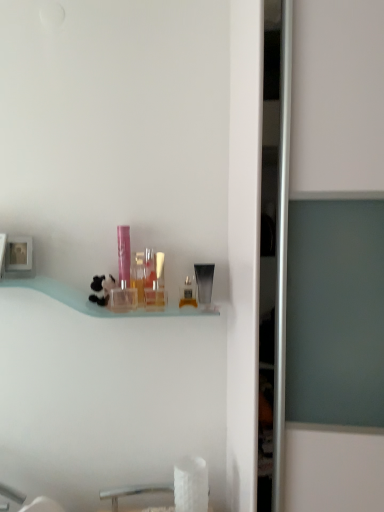
What do you see at coordinates (204, 282) in the screenshot? I see `clear plastic container at center, which ranks as the sixth toiletry in left-to-right order` at bounding box center [204, 282].

How much space does translucent plastic container at center, the 2th toiletry viewed from the left, occupy vertically?

translucent plastic container at center, the 2th toiletry viewed from the left, is 7.40 inches tall.

At what (x,y) coordinates should I click in order to perform the action: click on white ceramic sink at lower center. Please return your answer as a coordinate pair (x, y). Looking at the image, I should click on (174, 487).

Image resolution: width=384 pixels, height=512 pixels. Describe the element at coordinates (160, 279) in the screenshot. I see `translucent plastic perfume bottle at center, the 4th toiletry when ordered from left to right` at that location.

Identify the location of white matte toilet paper at lower center. (191, 485).

At what (x,y) coordinates should I click in order to perform the action: click on clear plastic bottle at center, the 5th toiletry in the left-to-right sequence. Please return your answer as a coordinate pair (x, y). Looking at the image, I should click on (188, 293).

From their relative heights in the image, would you say white matte toilet paper at lower center is taller or shorter than clear plastic container at center, placed as the 1th toiletry when sorted from right to left?

Clearly, white matte toilet paper at lower center is taller compared to clear plastic container at center, placed as the 1th toiletry when sorted from right to left.

Can you confirm if white matte toilet paper at lower center is bigger than clear plastic container at center, placed as the 1th toiletry when sorted from right to left?

Correct, white matte toilet paper at lower center is larger in size than clear plastic container at center, placed as the 1th toiletry when sorted from right to left.

Locate an element on the screen. The image size is (384, 512). toilet paper on the left of the clear plastic container at center, placed as the 1th toiletry when sorted from right to left is located at coordinates (191, 485).

Is point (200, 505) less distant than point (210, 285)?

Yes, point (200, 505) is closer to viewer.

Is translucent plastic container at center, the fifth toiletry in the right-to-left sequence, oriented towards white ceramic sink at lower center?

No, translucent plastic container at center, the fifth toiletry in the right-to-left sequence, is not turned towards white ceramic sink at lower center.

In terms of size, does translucent plastic container at center, the 2th toiletry viewed from the left, appear bigger or smaller than white ceramic sink at lower center?

In the image, translucent plastic container at center, the 2th toiletry viewed from the left, appears to be smaller than white ceramic sink at lower center.

Based on the photo, is translucent plastic container at center, the 2th toiletry viewed from the left, at the left side of white ceramic sink at lower center?

Yes.

Is translucent plastic container at center, the fifth toiletry in the right-to-left sequence, placed right next to white ceramic sink at lower center?

translucent plastic container at center, the fifth toiletry in the right-to-left sequence, is not next to white ceramic sink at lower center, and they're not touching.

Considering the relative sizes of white ceramic sink at lower center and clear plastic container at center, placed as the 4th toiletry when sorted from right to left, in the image provided, is white ceramic sink at lower center bigger than clear plastic container at center, placed as the 4th toiletry when sorted from right to left,?

Yes.

Based on the photo, considering the positions of objects white ceramic sink at lower center and clear plastic container at center, placed as the 4th toiletry when sorted from right to left, in the image provided, who is more to the left, white ceramic sink at lower center or clear plastic container at center, placed as the 4th toiletry when sorted from right to left,?

Positioned to the left is clear plastic container at center, placed as the 4th toiletry when sorted from right to left.

Could you tell me if white ceramic sink at lower center is turned towards clear plastic container at center, the 3th toiletry positioned from the left?

No.

From a real-world perspective, count 5th toiletrys upward from the white ceramic sink at lower center and point to it. Please provide its 2D coordinates.

[(150, 278)]

Are translucent plastic perfume bottle at center, the 4th toiletry when ordered from left to right, and white matte toilet paper at lower center located far from each other?

Actually, translucent plastic perfume bottle at center, the 4th toiletry when ordered from left to right, and white matte toilet paper at lower center are a little close together.

Is translucent plastic perfume bottle at center, positioned as the third toiletry in right-to-left order, outside of white matte toilet paper at lower center?

translucent plastic perfume bottle at center, positioned as the third toiletry in right-to-left order, is positioned outside white matte toilet paper at lower center.

What are the coordinates of `the 2nd toiletry counting from the left side of the white matte toilet paper at lower center` in the screenshot? It's located at (160, 279).

Which of these two, translucent plastic perfume bottle at center, the 4th toiletry when ordered from left to right, or white ceramic sink at lower center, is wider?

With larger width is translucent plastic perfume bottle at center, the 4th toiletry when ordered from left to right.

How far apart are translucent plastic perfume bottle at center, positioned as the third toiletry in right-to-left order, and white ceramic sink at lower center?

They are 22.97 inches apart.

Consider the image. Considering the relative positions of translucent plastic perfume bottle at center, positioned as the third toiletry in right-to-left order, and white ceramic sink at lower center in the image provided, is translucent plastic perfume bottle at center, positioned as the third toiletry in right-to-left order, to the left or to the right of white ceramic sink at lower center?

In the image, translucent plastic perfume bottle at center, positioned as the third toiletry in right-to-left order, appears on the right side of white ceramic sink at lower center.

Who is taller, clear plastic bottle at center, which is counted as the 2th toiletry, starting from the right, or clear plastic container at center, placed as the 1th toiletry when sorted from right to left?

Standing taller between the two is clear plastic container at center, placed as the 1th toiletry when sorted from right to left.

Considering the positions of objects clear plastic bottle at center, the 5th toiletry in the left-to-right sequence, and clear plastic container at center, which ranks as the sixth toiletry in left-to-right order, in the image provided, who is more to the right, clear plastic bottle at center, the 5th toiletry in the left-to-right sequence, or clear plastic container at center, which ranks as the sixth toiletry in left-to-right order,?

Positioned to the right is clear plastic container at center, which ranks as the sixth toiletry in left-to-right order.

Which object is further away from the camera taking this photo, clear plastic bottle at center, the 5th toiletry in the left-to-right sequence, or clear plastic container at center, which ranks as the sixth toiletry in left-to-right order?

Positioned behind is clear plastic container at center, which ranks as the sixth toiletry in left-to-right order.

Which is closer, (186, 277) or (197, 272)?

The point (186, 277) is more forward.

Which object is positioned more to the left, clear plastic container at center, which ranks as the sixth toiletry in left-to-right order, or translucent plastic container at center, the 2th toiletry viewed from the left?

translucent plastic container at center, the 2th toiletry viewed from the left.

Looking at this image, which of these two, clear plastic container at center, which ranks as the sixth toiletry in left-to-right order, or translucent plastic container at center, the fifth toiletry in the right-to-left sequence, stands taller?

translucent plastic container at center, the fifth toiletry in the right-to-left sequence, is taller.

Can translucent plastic container at center, the fifth toiletry in the right-to-left sequence, be found inside clear plastic container at center, placed as the 1th toiletry when sorted from right to left?

No, clear plastic container at center, placed as the 1th toiletry when sorted from right to left, does not contain translucent plastic container at center, the fifth toiletry in the right-to-left sequence.

This screenshot has width=384, height=512. Identify the location of toilet paper below the clear plastic container at center, placed as the 1th toiletry when sorted from right to left (from a real-world perspective). (191, 485).

This screenshot has height=512, width=384. What are the coordinates of `sink behind the translucent plastic container at center, the 2th toiletry viewed from the left` in the screenshot? It's located at (174, 487).

Based on their spatial positions, is white ceramic sink at lower center or clear plastic container at center, placed as the 4th toiletry when sorted from right to left, further from pink glossy tube at center, placed as the sixth toiletry when sorted from right to left?

white ceramic sink at lower center.

Estimate the real-world distances between objects in this image. Which object is further from clear plastic bottle at center, which is counted as the 2th toiletry, starting from the right, white ceramic sink at lower center or pink glossy tube at center, placed as the sixth toiletry when sorted from right to left?

white ceramic sink at lower center lies further to clear plastic bottle at center, which is counted as the 2th toiletry, starting from the right, than the other object.

Based on their spatial positions, is clear plastic container at center, placed as the 1th toiletry when sorted from right to left, or pink glossy tube at center, placed as the sixth toiletry when sorted from right to left, further from translucent plastic container at center, the fifth toiletry in the right-to-left sequence?

Among the two, clear plastic container at center, placed as the 1th toiletry when sorted from right to left, is located further to translucent plastic container at center, the fifth toiletry in the right-to-left sequence.

When comparing their distances from translucent plastic container at center, the 2th toiletry viewed from the left, does white ceramic sink at lower center or clear plastic container at center, which ranks as the sixth toiletry in left-to-right order, seem closer?

clear plastic container at center, which ranks as the sixth toiletry in left-to-right order, lies closer to translucent plastic container at center, the 2th toiletry viewed from the left, than the other object.

Estimate the real-world distances between objects in this image. Which object is closer to pink glossy tube at center, the first toiletry from the left, clear plastic container at center, the 3th toiletry positioned from the left, or translucent plastic perfume bottle at center, positioned as the third toiletry in right-to-left order?

clear plastic container at center, the 3th toiletry positioned from the left.

Considering their positions, is white ceramic sink at lower center positioned closer to clear plastic container at center, placed as the 1th toiletry when sorted from right to left, than clear plastic container at center, placed as the 4th toiletry when sorted from right to left?

Among the two, clear plastic container at center, placed as the 4th toiletry when sorted from right to left, is located nearer to clear plastic container at center, placed as the 1th toiletry when sorted from right to left.

From the image, which object appears to be nearer to white ceramic sink at lower center, clear plastic container at center, placed as the 1th toiletry when sorted from right to left, or white matte toilet paper at lower center?

white matte toilet paper at lower center lies closer to white ceramic sink at lower center than the other object.

In the scene shown: Estimate the real-world distances between objects in this image. Which object is further from clear plastic bottle at center, the 5th toiletry in the left-to-right sequence, translucent plastic container at center, the fifth toiletry in the right-to-left sequence, or pink glossy tube at center, the first toiletry from the left?

pink glossy tube at center, the first toiletry from the left.

Locate an element on the screen. This screenshot has height=512, width=384. toilet paper that lies between pink glossy tube at center, the first toiletry from the left, and white ceramic sink at lower center from top to bottom is located at coordinates (191, 485).

Find the location of a particular element. toiletry between pink glossy tube at center, the first toiletry from the left, and clear plastic container at center, the 3th toiletry positioned from the left, from left to right is located at coordinates (138, 275).

I want to click on toilet paper between translucent plastic container at center, the fifth toiletry in the right-to-left sequence, and white ceramic sink at lower center, in the vertical direction, so click(x=191, y=485).

What are the coordinates of `toiletry between clear plastic container at center, placed as the 1th toiletry when sorted from right to left, and white ceramic sink at lower center in the up-down direction` in the screenshot? It's located at (188, 293).